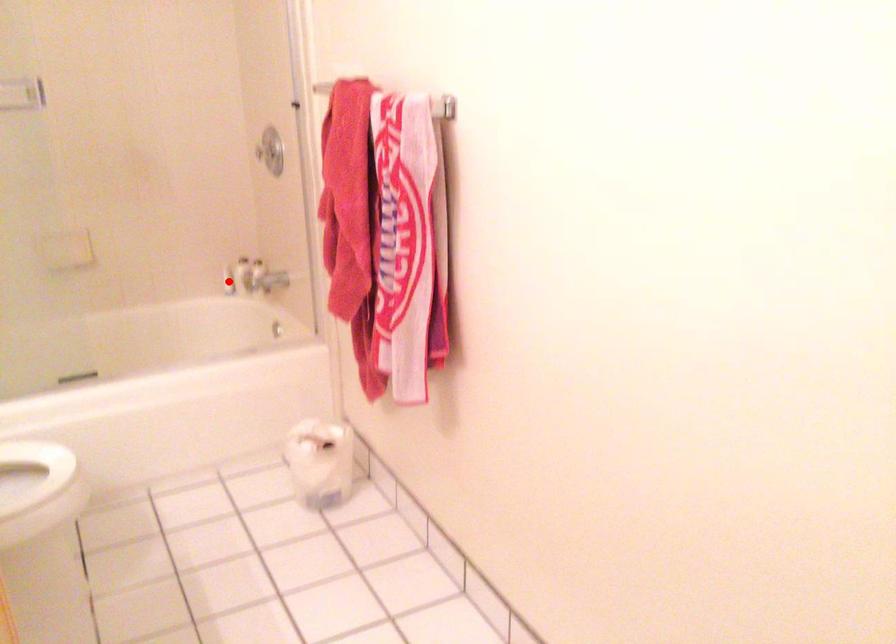
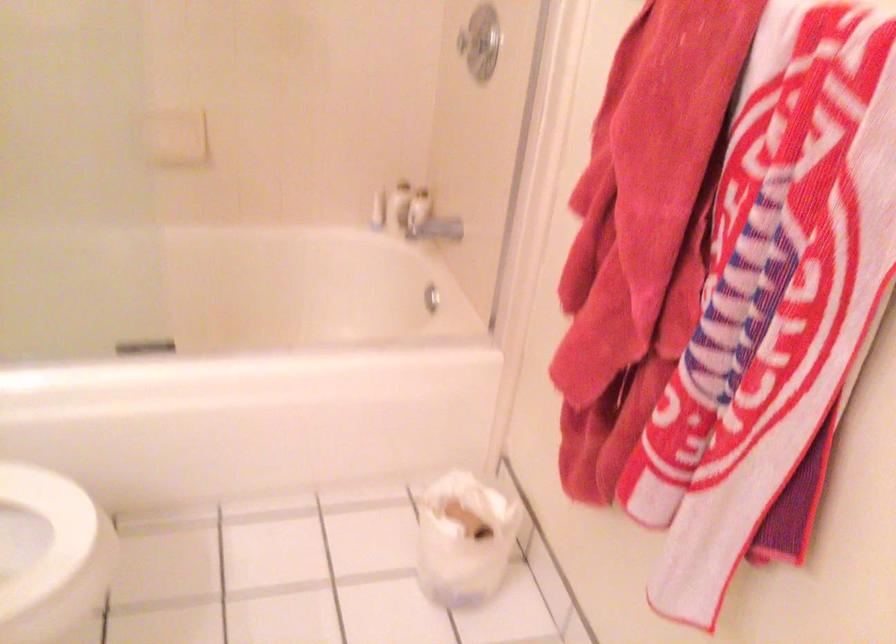
Question: I am providing you with two images of the same scene from different viewpoints. Given a red point in image1, look at the same physical point in image2. Is it:

Choices:
 (A) Closer to the viewpoint
 (B) Farther from the viewpoint

Answer: (A)